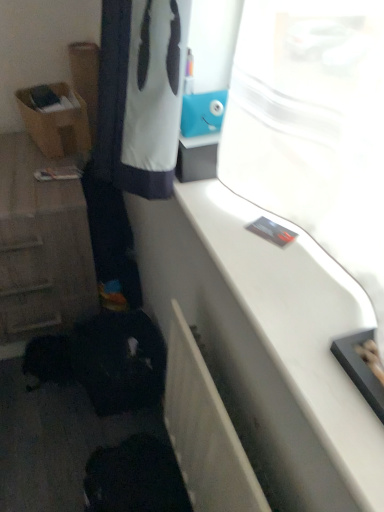
Question: Is brown cardboard box at left taller than white glossy counter top at upper right?

Choices:
 (A) yes
 (B) no

Answer: (A)

Question: Is brown cardboard box at left positioned far away from white glossy counter top at upper right?

Choices:
 (A) yes
 (B) no

Answer: (B)

Question: Could you tell me if brown cardboard box at left is turned towards white glossy counter top at upper right?

Choices:
 (A) no
 (B) yes

Answer: (A)

Question: Could white glossy counter top at upper right be considered to be inside brown cardboard box at left?

Choices:
 (A) yes
 (B) no

Answer: (B)

Question: From a real-world perspective, does brown cardboard box at left sit lower than white glossy counter top at upper right?

Choices:
 (A) no
 (B) yes

Answer: (B)

Question: Does brown cardboard box at left have a smaller size compared to white glossy counter top at upper right?

Choices:
 (A) no
 (B) yes

Answer: (A)

Question: Is white glossy counter top at upper right looking in the opposite direction of wooden cabinet at left?

Choices:
 (A) yes
 (B) no

Answer: (B)

Question: Is there a large distance between white glossy counter top at upper right and wooden cabinet at left?

Choices:
 (A) yes
 (B) no

Answer: (B)

Question: From a real-world perspective, is white glossy counter top at upper right over wooden cabinet at left?

Choices:
 (A) yes
 (B) no

Answer: (A)

Question: From the image's perspective, is white glossy counter top at upper right located above wooden cabinet at left?

Choices:
 (A) yes
 (B) no

Answer: (B)

Question: Are white glossy counter top at upper right and wooden cabinet at left making contact?

Choices:
 (A) yes
 (B) no

Answer: (B)

Question: Is white glossy counter top at upper right shorter than wooden cabinet at left?

Choices:
 (A) yes
 (B) no

Answer: (A)

Question: From a real-world perspective, is wooden cabinet at left located higher than white glossy counter top at upper right?

Choices:
 (A) yes
 (B) no

Answer: (B)